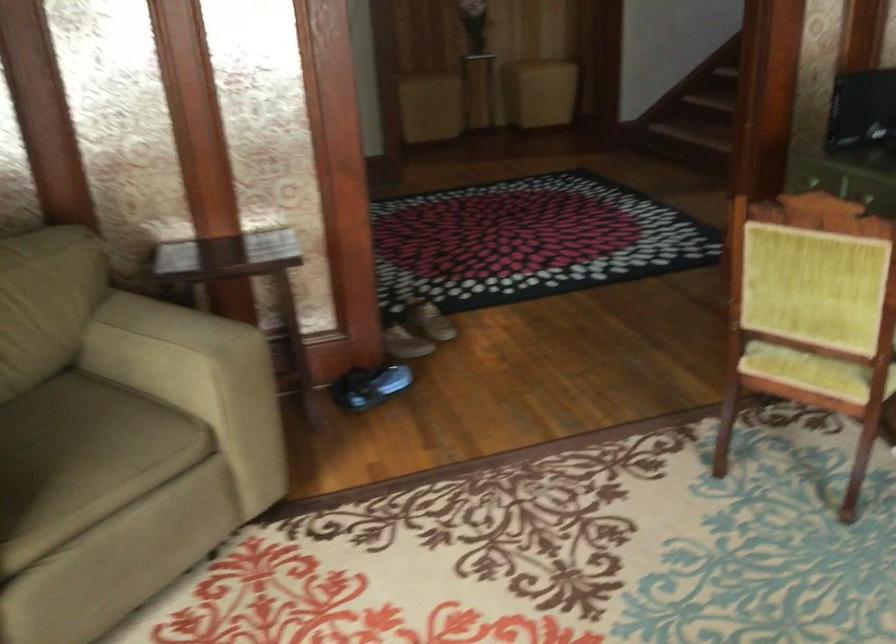
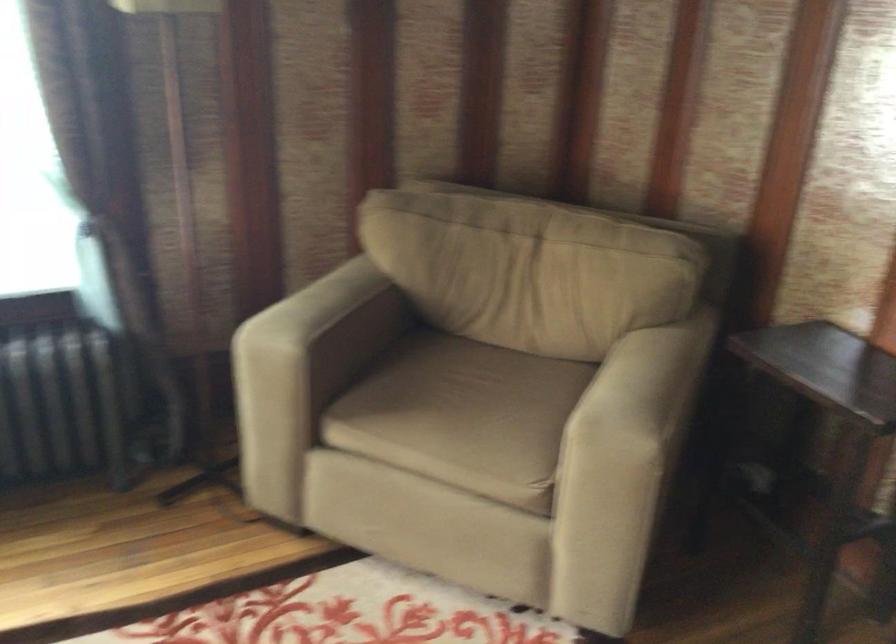
Find the pixel in the second image that matches the point at 81,447 in the first image.

(458, 413)